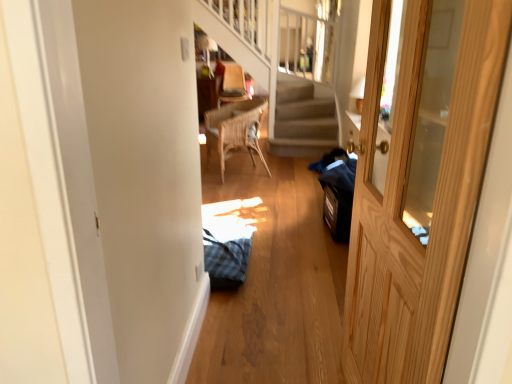
Question: From the image's perspective, does wooden door at right appear higher than woven wood chair at center?

Choices:
 (A) yes
 (B) no

Answer: (B)

Question: Can woven wood chair at center be found inside wooden door at right?

Choices:
 (A) yes
 (B) no

Answer: (B)

Question: Considering the relative sizes of wooden door at right and woven wood chair at center in the image provided, is wooden door at right bigger than woven wood chair at center?

Choices:
 (A) no
 (B) yes

Answer: (A)

Question: Is wooden door at right completely or partially outside of woven wood chair at center?

Choices:
 (A) yes
 (B) no

Answer: (A)

Question: Considering the relative positions of wooden door at right and woven wood chair at center in the image provided, is wooden door at right in front of woven wood chair at center?

Choices:
 (A) yes
 (B) no

Answer: (A)

Question: From the image's perspective, is wooden door at right located beneath woven wood chair at center?

Choices:
 (A) yes
 (B) no

Answer: (A)

Question: Considering the relative sizes of wooden door at right and wooden woven armchair at upper center in the image provided, is wooden door at right wider than wooden woven armchair at upper center?

Choices:
 (A) no
 (B) yes

Answer: (A)

Question: Does wooden door at right appear on the left side of wooden woven armchair at upper center?

Choices:
 (A) yes
 (B) no

Answer: (B)

Question: Does wooden door at right have a lesser height compared to wooden woven armchair at upper center?

Choices:
 (A) yes
 (B) no

Answer: (B)

Question: Considering the relative positions of wooden door at right and wooden woven armchair at upper center in the image provided, is wooden door at right to the right of wooden woven armchair at upper center from the viewer's perspective?

Choices:
 (A) no
 (B) yes

Answer: (B)

Question: Is wooden door at right bigger than wooden woven armchair at upper center?

Choices:
 (A) no
 (B) yes

Answer: (A)

Question: Does wooden door at right have a greater height compared to wooden woven armchair at upper center?

Choices:
 (A) yes
 (B) no

Answer: (A)

Question: From a real-world perspective, does wooden woven armchair at upper center stand above wooden door at right?

Choices:
 (A) no
 (B) yes

Answer: (A)